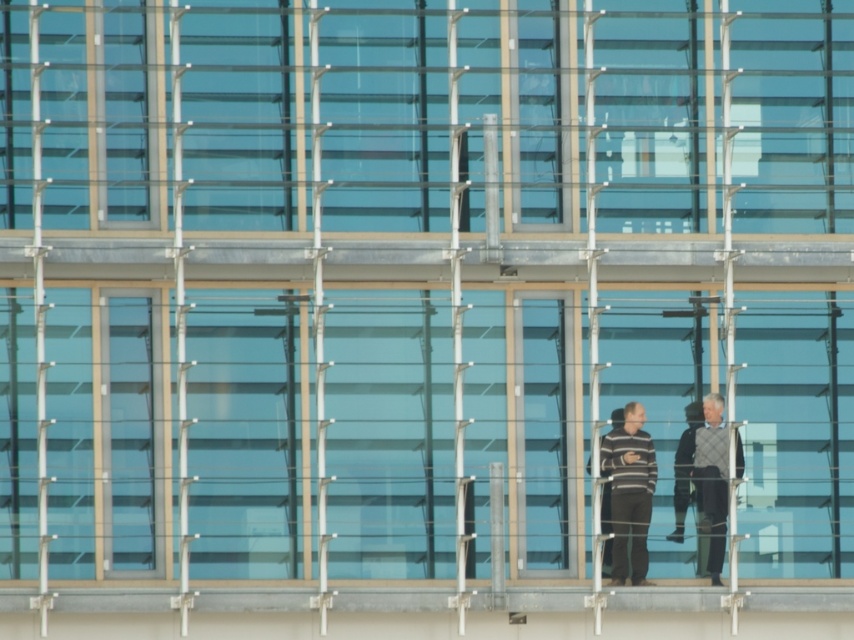
Which is above, knitted sweater at center or gray wool sweater at center?

Positioned higher is gray wool sweater at center.

Is knitted sweater at center wider than gray wool sweater at center?

Correct, the width of knitted sweater at center exceeds that of gray wool sweater at center.

The width and height of the screenshot is (854, 640). In order to click on knitted sweater at center in this screenshot , I will do [712, 477].

The height and width of the screenshot is (640, 854). I want to click on knitted sweater at center, so click(x=712, y=477).

Does striped sweater at center have a greater height compared to gray wool sweater at center?

Correct, striped sweater at center is much taller as gray wool sweater at center.

Does striped sweater at center have a smaller size compared to gray wool sweater at center?

No, striped sweater at center is not smaller than gray wool sweater at center.

The width and height of the screenshot is (854, 640). Identify the location of striped sweater at center. (629, 492).

Is striped sweater at center smaller than knitted sweater at center?

Correct, striped sweater at center occupies less space than knitted sweater at center.

Consider the image. Which is below, striped sweater at center or knitted sweater at center?

Positioned lower is striped sweater at center.

Locate an element on the screen. striped sweater at center is located at coordinates (629, 492).